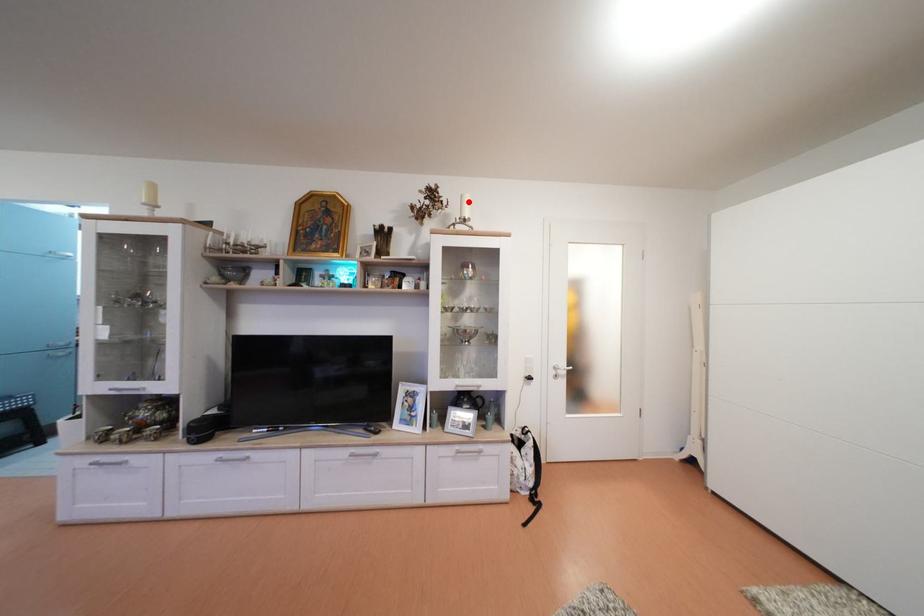
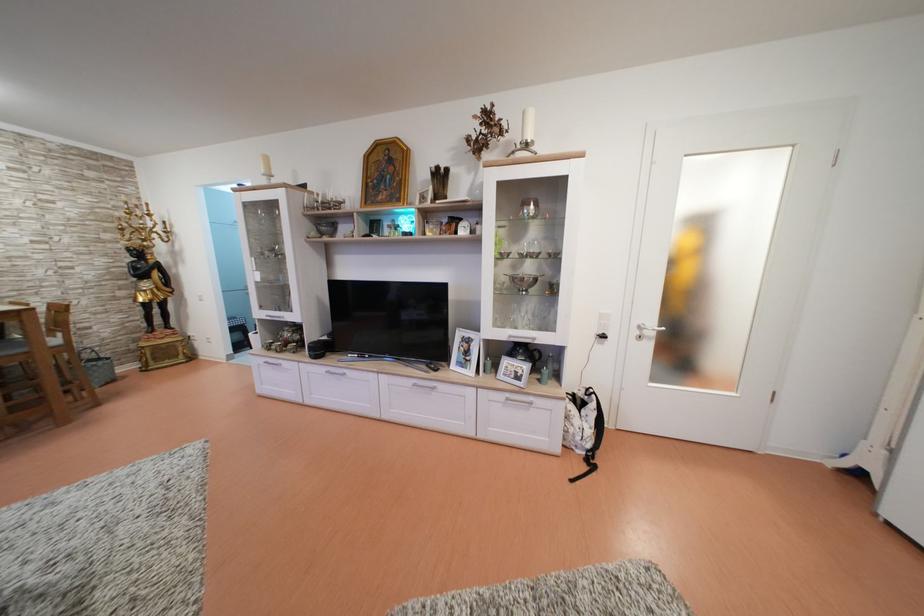
In the second image, find the point that corresponds to the highlighted location in the first image.

(530, 119)